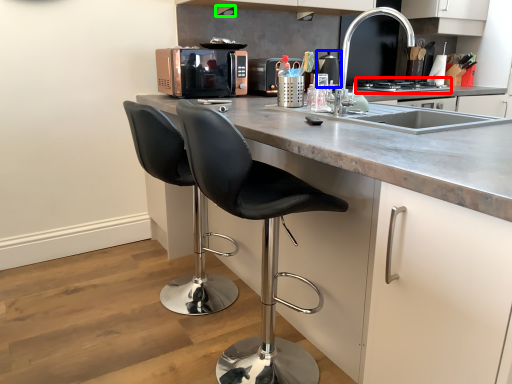
Question: Which object is positioned farthest from stove (highlighted by a red box)? Select from appliance (highlighted by a blue box) and exhaust hood (highlighted by a green box).

Choices:
 (A) appliance
 (B) exhaust hood

Answer: (B)